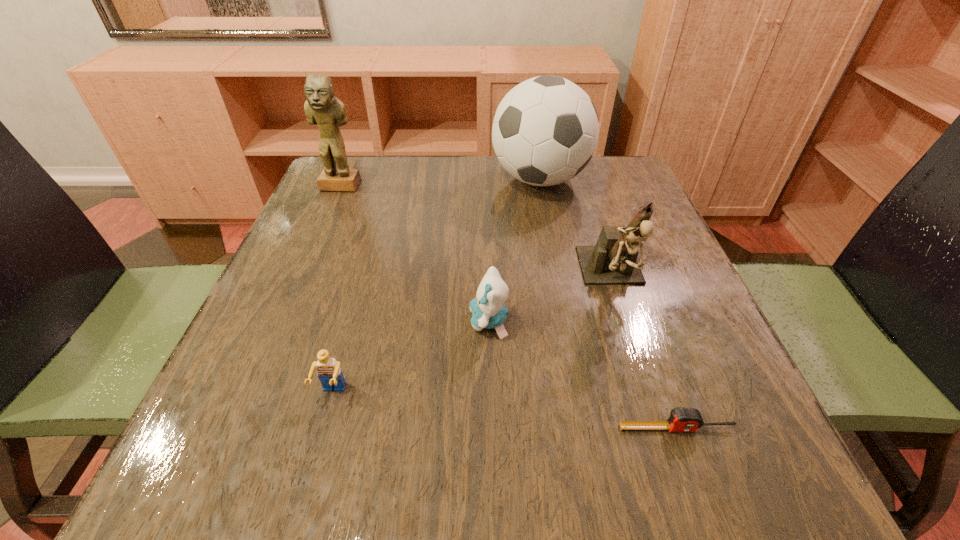
Image resolution: width=960 pixels, height=540 pixels. Identify the location of vacant area at the near edge of the desktop. (399, 462).

What are the coordinates of `vacant space at the left edge` in the screenshot? It's located at (247, 347).

Where is `vacant space at the right edge of the desktop`? vacant space at the right edge of the desktop is located at coordinates (622, 207).

You are a GUI agent. You are given a task and a screenshot of the screen. Output one action in this format:
    pyautogui.click(x=<x>, y=<y>)
    Task: Click on the vacant space at the far left corner of the desktop
    This screenshot has width=960, height=540.
    Given the screenshot: What is the action you would take?
    pyautogui.click(x=370, y=176)

Identify the location of free space at the far right corner. (640, 199).

The width and height of the screenshot is (960, 540). What are the coordinates of `free spot between the Lego and the soccer ball` in the screenshot? It's located at (436, 287).

Locate an element on the screen. The height and width of the screenshot is (540, 960). free area in between the second nearest object and the fourth tallest object is located at coordinates (411, 357).

Where is `vacant area between the shortest object and the soccer ball`? The height and width of the screenshot is (540, 960). vacant area between the shortest object and the soccer ball is located at coordinates (609, 304).

At what (x,y) coordinates should I click in order to perform the action: click on free space between the soccer ball and the taller figurine. Please return your answer as a coordinate pair (x, y). The width and height of the screenshot is (960, 540). Looking at the image, I should click on (440, 183).

Locate an element on the screen. vacant area that lies between the nearer figurine and the fourth tallest object is located at coordinates (551, 300).